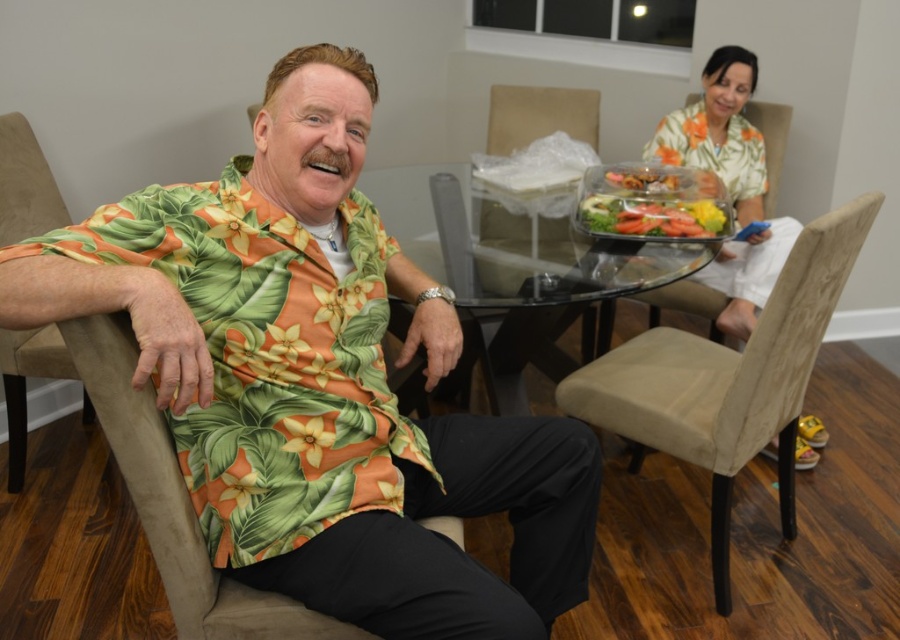
You are standing at the entrance of the dining area and want to walk to the point marked as point (x=454, y=547). There is an obstacle at point (x=573, y=125). Will you encounter the obstacle before reaching your destination?

Since point (x=454, y=547) is in front of point (x=573, y=125), you will reach your destination before encountering the obstacle at point (x=573, y=125).

You are standing at the entrance of the dining area and want to walk to the point marked as point (338, 129). There is an obstacle at point (709, 186). Will you be able to reach your destination without going around the obstacle?

Yes, because point (338, 129) is in front of point (709, 186), so the obstacle is behind your destination and you can reach it directly.

You are a delivery person who needs to place a package on the translucent plastic container at center. The package is 2 meters long. Can you place it on the container without it hanging off?

The translucent plastic container at center is 2.01 meters away from the camera. The distance from the camera does not indicate the container size. Therefore, we cannot determine if the package will fit based on the given information.